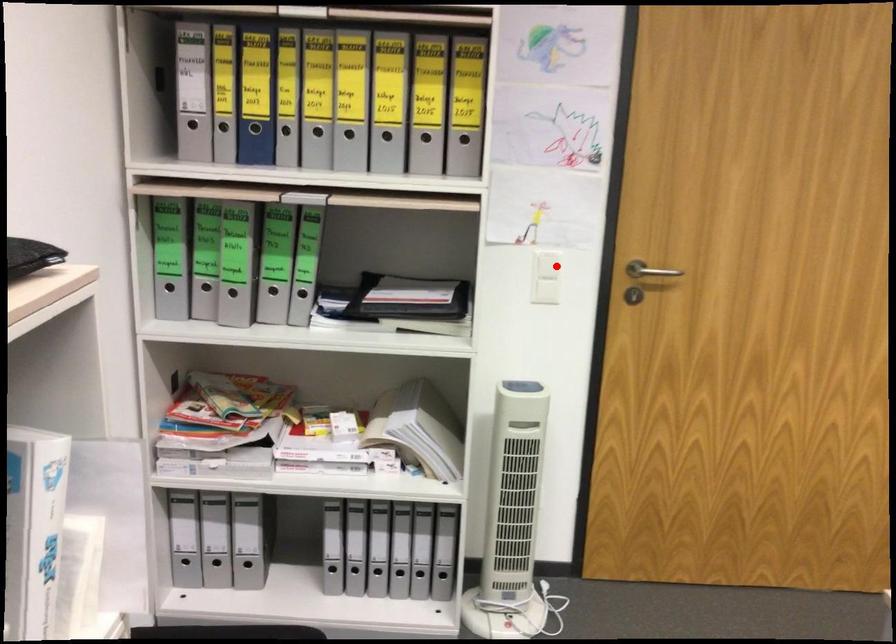
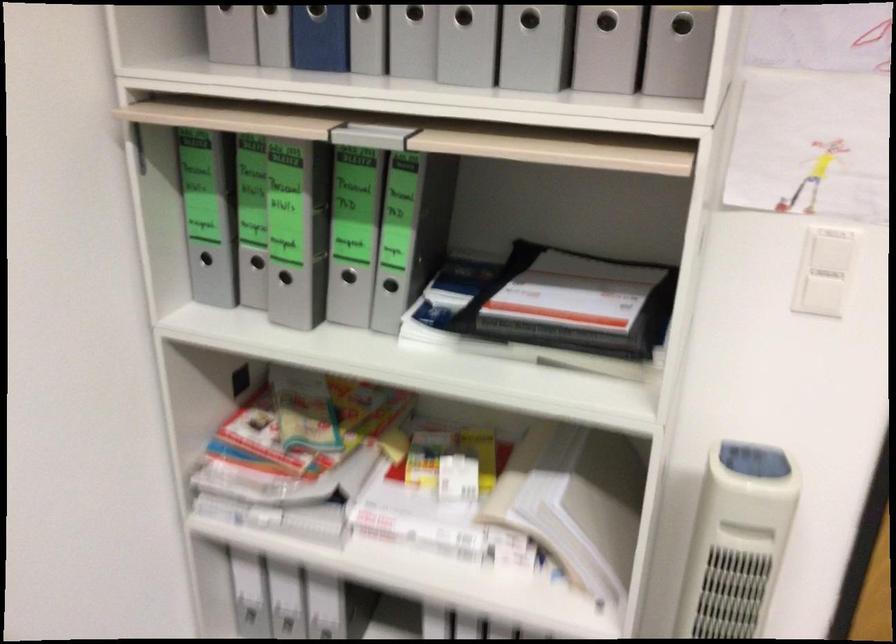
In the second image, find the point that corresponds to the highlighted location in the first image.

(831, 252)